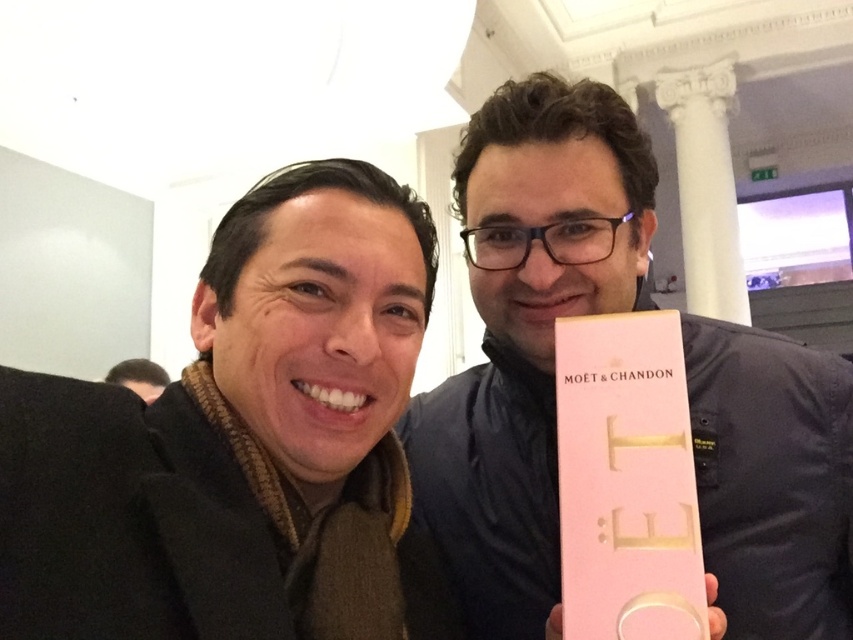
You are standing in the room where the two people are posing. There is a point at coordinates (526,332). Which object is this point located on?

The point at coordinates (526,332) is located on the pink matte box at right.

You are a photographer taking a picture of the two people in the scene. You need to ensure that the pink matte box at right and the brown hair at upper left are both visible in the frame. Based on their sizes, which object should you focus on to ensure both are in focus?

The pink matte box at right is taller than brown hair at upper left, so focusing on the pink matte box at right would ensure both are in focus since it is larger and requires more attention.

You are standing in the room where the two people are posing. You need to place a new decorative item exactly where the pink matte box at right is currently located. What are the coordinates of the spot where you should place the new item?

The coordinates for the spot where the pink matte box at right is located are [526,332].